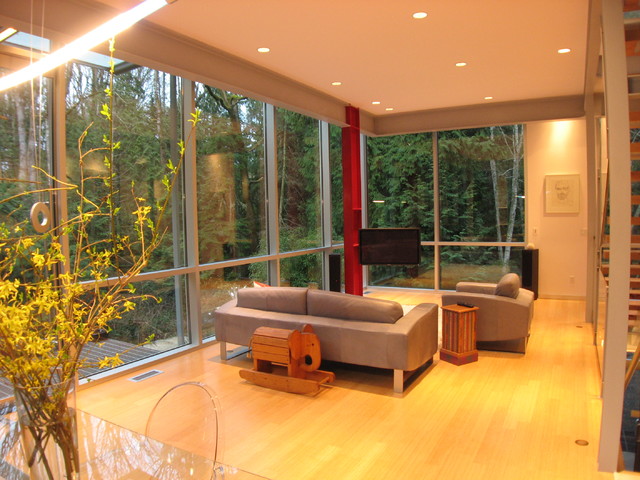
Where is `chair table`? chair table is located at coordinates (459, 320).